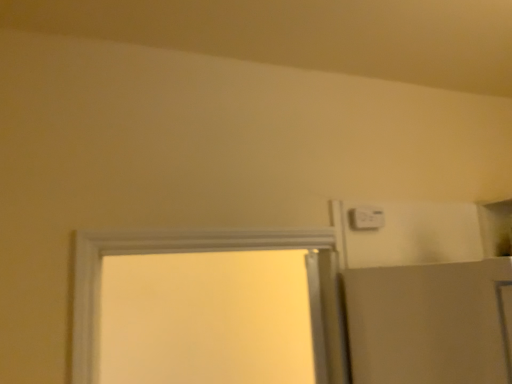
Question: Should I look upward or downward to see white plastic light switch at upper right?

Choices:
 (A) up
 (B) down

Answer: (B)